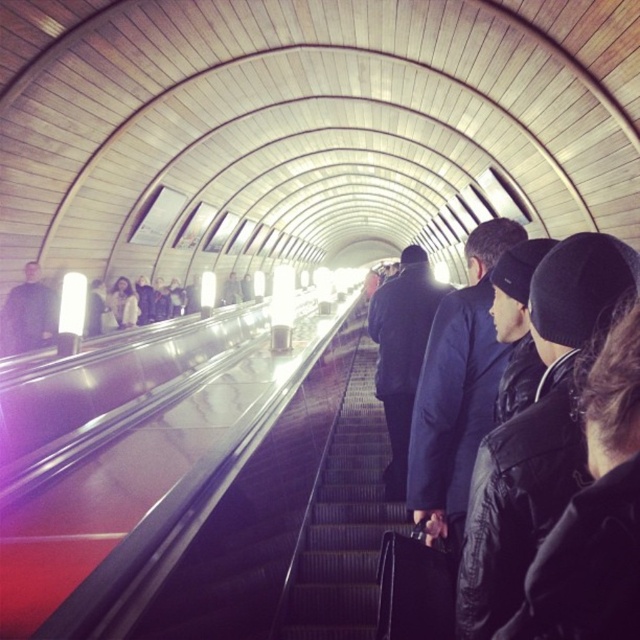
You are a person standing on the escalator and want to know if the black leather jacket at center can fit into a space that is the same width as the dark blue jacket at left. Can it fit?

The black leather jacket at center is narrower than the dark blue jacket at left, so it can fit into the space.

You are standing at the entrance of the subway station and see the black leather jacket at center on the escalator. If you want to reach the jacket quickly, which direction should you move towards?

The black leather jacket at center is located at point (x=458, y=388), so you should move towards the center of the escalator to reach it quickly.